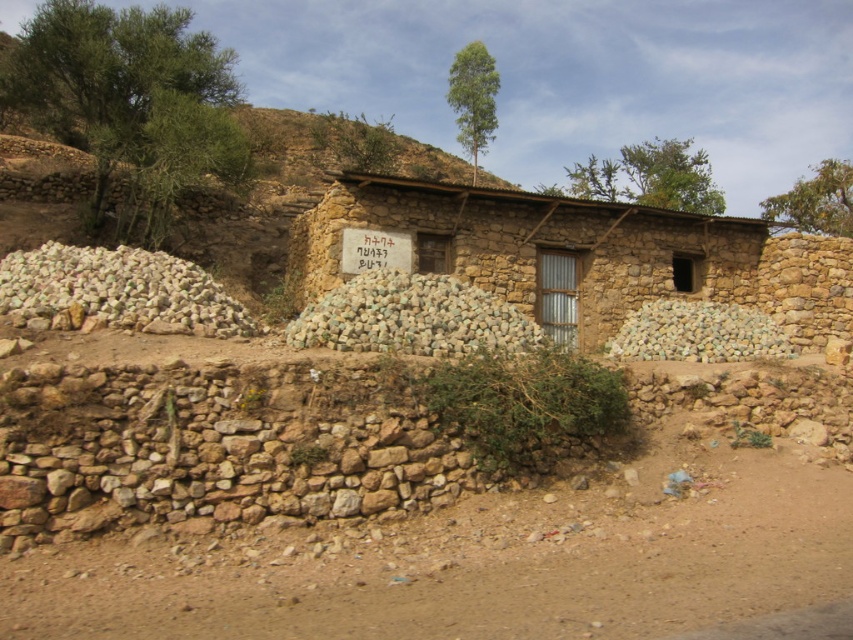
Who is more distant from viewer, (183,307) or (675,326)?

The point (675,326) is more distant.

Based on the photo, does white smooth stones at left have a smaller size compared to white smooth stones at center?

No.

You are a GUI agent. You are given a task and a screenshot of the screen. Output one action in this format:
    pyautogui.click(x=<x>, y=<y>)
    Task: Click on the white smooth stones at left
    This screenshot has height=640, width=853.
    Given the screenshot: What is the action you would take?
    pyautogui.click(x=119, y=288)

Where is `white smooth stones at left`? white smooth stones at left is located at coordinates (119, 288).

Is brown mud hut at center above white smooth stones at left?

Correct, brown mud hut at center is located above white smooth stones at left.

Looking at this image, how far apart are brown mud hut at center and white smooth stones at left?

The distance of brown mud hut at center from white smooth stones at left is 4.56 meters.

The height and width of the screenshot is (640, 853). Describe the element at coordinates (526, 250) in the screenshot. I see `brown mud hut at center` at that location.

Find the location of a particular element. brown mud hut at center is located at coordinates [x=526, y=250].

Which of these two, brown mud hut at center or white smooth stones at center, stands taller?

brown mud hut at center is taller.

Is brown mud hut at center thinner than white smooth stones at center?

In fact, brown mud hut at center might be wider than white smooth stones at center.

Where is `brown mud hut at center`? brown mud hut at center is located at coordinates (526, 250).